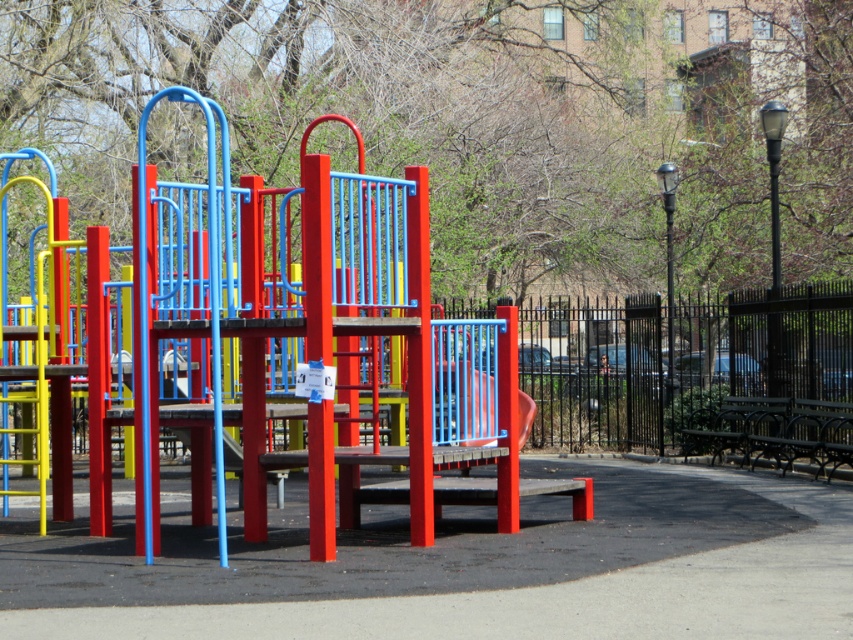
You are a parent looking for a place to sit while watching your child play on the smooth plastic slide at center. Is the black metal bench at right positioned in a way that you can see the slide from there?

The black metal bench at right is to the right of smooth plastic slide at center, so yes, you can see the slide from the bench.

You are standing at the entrance of the playground and notice two points marked in the image. The first point is at coordinates point (801, 403) and the second is at point (751, 428). Which of these two points is nearer to your current position?

Point (801, 403) is closer to the camera than point (751, 428), so the first point is nearer to your current position.

You are a parent trying to decide where to place your child on the playground. The black polished wood bench at lower right and the smooth plastic slide at center are both options. Which object is wider?

The black polished wood bench at lower right might be wider than smooth plastic slide at center.